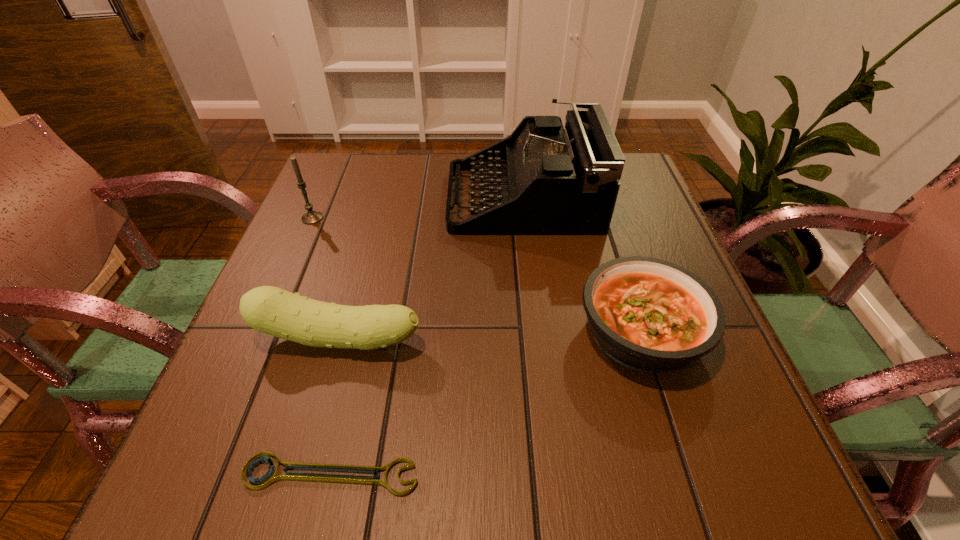
Find the location of a particular element. Image resolution: width=960 pixels, height=540 pixels. blank space that satisfies the following two spatial constraints: 1. on the typing side of the typewriter; 2. on the front side of the fourth shortest object is located at coordinates (525, 218).

Image resolution: width=960 pixels, height=540 pixels. In order to click on free region that satisfies the following two spatial constraints: 1. on the typing side of the typewriter; 2. on the left side of the second shortest object in this screenshot , I will do `click(539, 332)`.

This screenshot has width=960, height=540. In order to click on free location that satisfies the following two spatial constraints: 1. on the back side of the stew; 2. on the right side of the shortest object in this screenshot , I will do `click(365, 332)`.

At what (x,y) coordinates should I click in order to perform the action: click on free space that satisfies the following two spatial constraints: 1. on the front side of the shortest object; 2. on the right side of the third shortest object. Please return your answer as a coordinate pair (x, y). The height and width of the screenshot is (540, 960). Looking at the image, I should click on (301, 475).